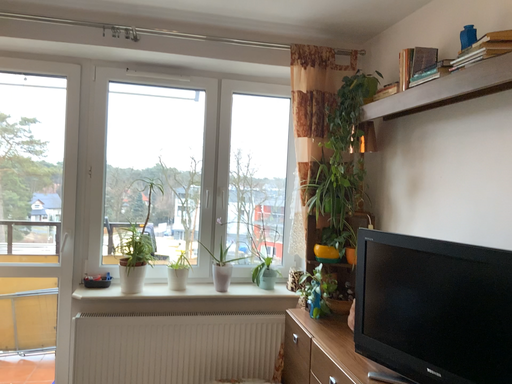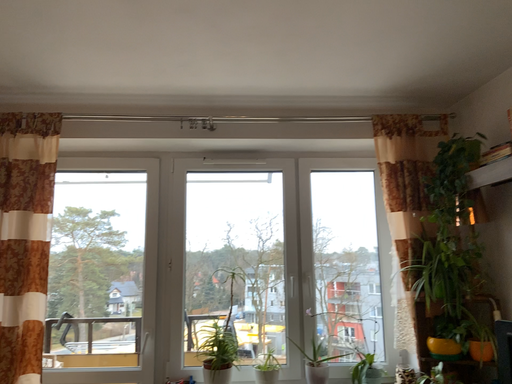
Question: How did the camera likely rotate when shooting the video?

Choices:
 (A) rotated upward
 (B) rotated downward

Answer: (A)